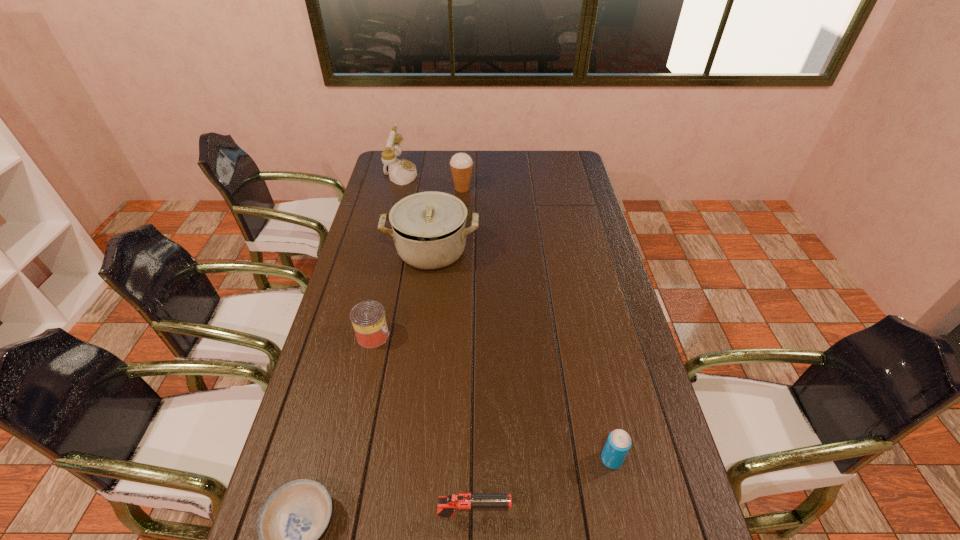
Image resolution: width=960 pixels, height=540 pixels. Identify the location of vacant position in the image that satisfies the following two spatial constraints: 1. on the dial of the telephone; 2. on the right side of the fourth farthest object. (360, 336).

The height and width of the screenshot is (540, 960). I want to click on vacant space that satisfies the following two spatial constraints: 1. on the dial of the telephone; 2. on the right side of the fifth nearest object, so click(x=381, y=251).

Where is `vacant space that satisfies the following two spatial constraints: 1. on the back side of the rightmost object; 2. on the dial of the telephone`? vacant space that satisfies the following two spatial constraints: 1. on the back side of the rightmost object; 2. on the dial of the telephone is located at coordinates pyautogui.click(x=550, y=173).